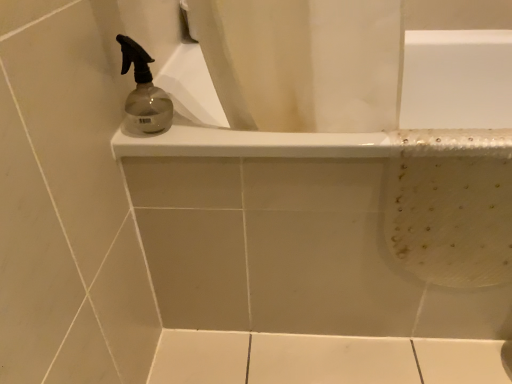
Where is `vacant area that lies to the right of transparent glass spray bottle at upper left`? The width and height of the screenshot is (512, 384). vacant area that lies to the right of transparent glass spray bottle at upper left is located at coordinates click(230, 133).